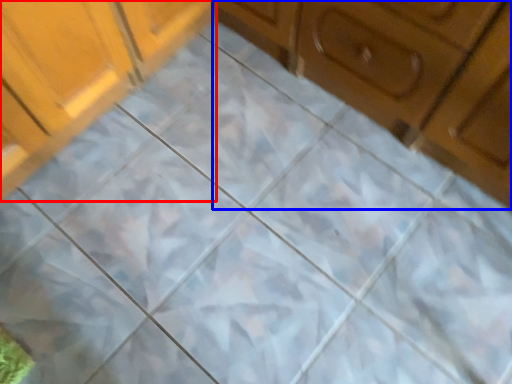
Question: Among these objects, which one is nearest to the camera, cabinetry (highlighted by a red box) or cabinetry (highlighted by a blue box)?

Choices:
 (A) cabinetry
 (B) cabinetry

Answer: (B)